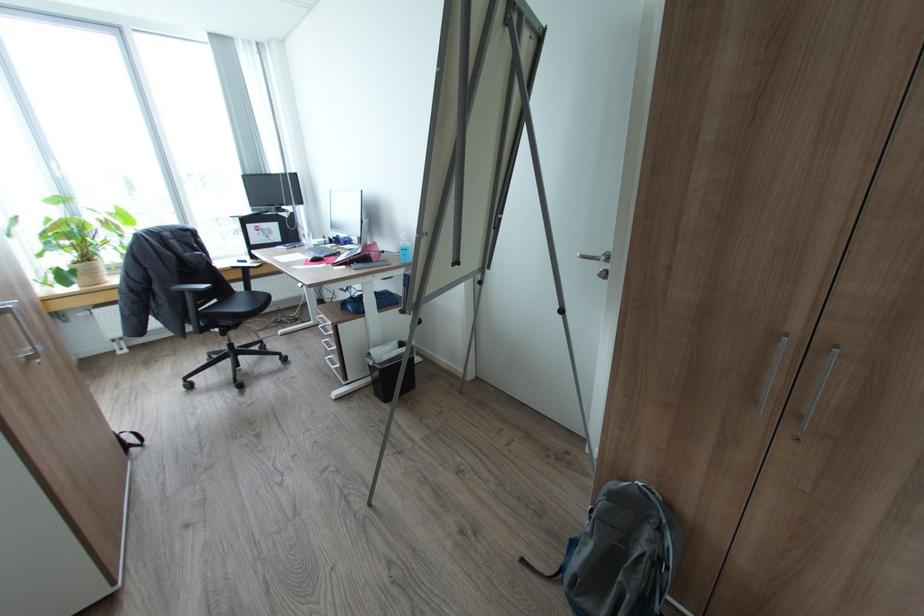
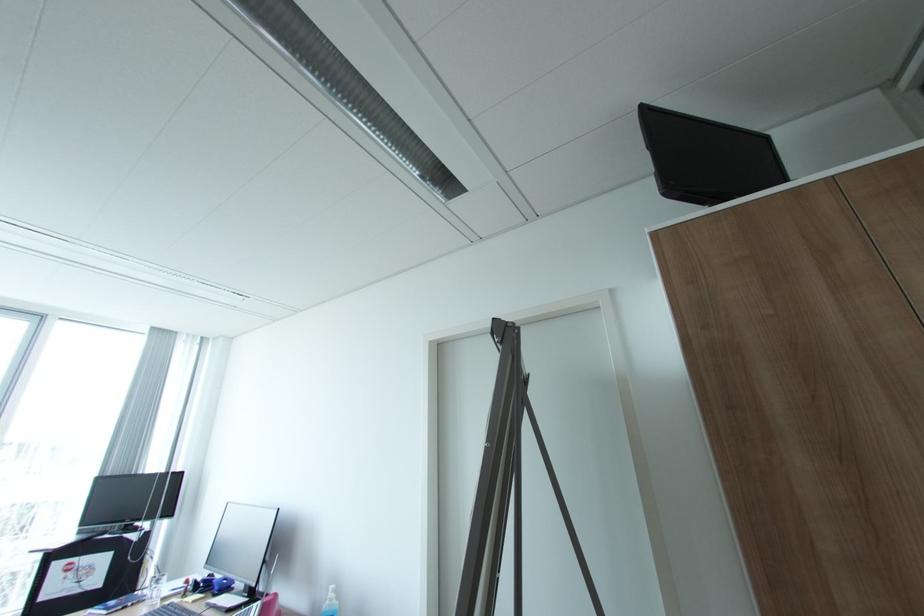
Find the pixel in the second image that matches [408,240] in the first image.

(336, 599)